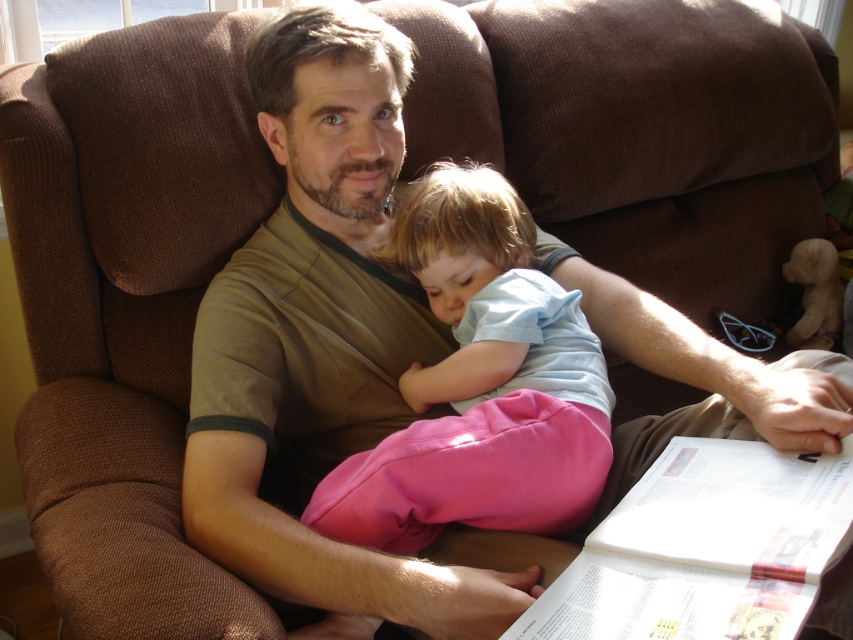
You are a photographer standing in front of the scene. You want to take a closeup photo of the pink cotton pants at center without moving any objects. Can you get close enough to capture the pants clearly in your shot?

The pink cotton pants at center and the viewer are 37.21 inches apart from each other. Since 37.21 inches is approximately 0.945 meters, and most cameras have a minimum focusing distance of around 0.3 meters, you can get close enough to capture the pink cotton pants at center clearly as long as you are within the camera lens focusing range.